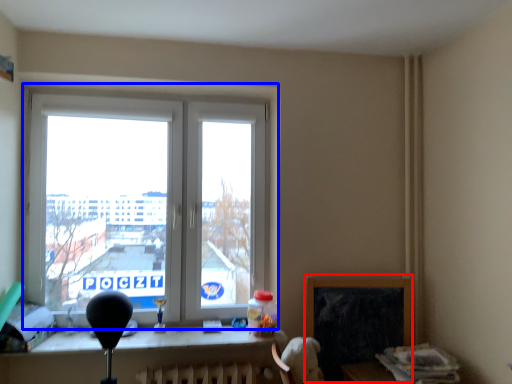
Question: Which object appears farthest to the camera in this image, window screen (highlighted by a red box) or window (highlighted by a blue box)?

Choices:
 (A) window screen
 (B) window

Answer: (A)